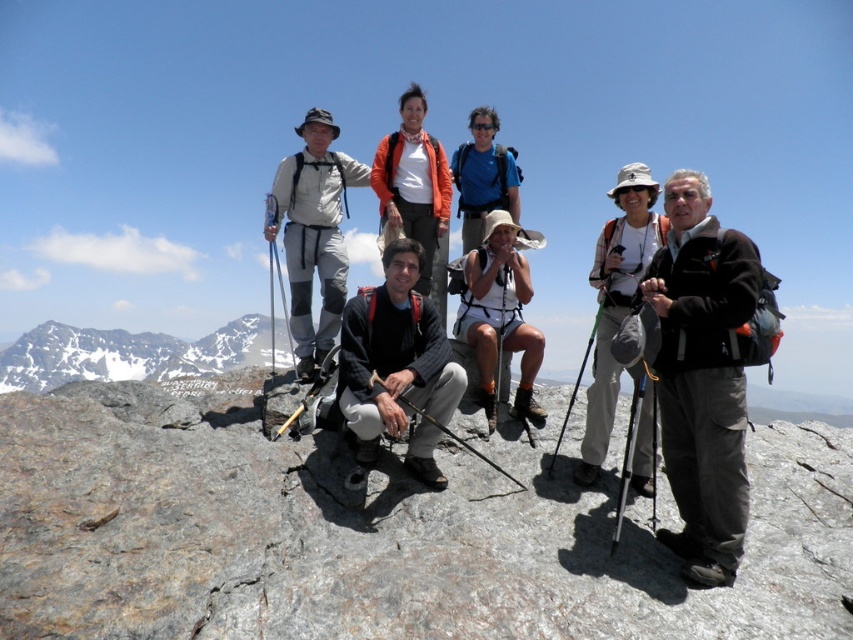
Is gray rock at center above black wool sweater at center?

Incorrect, gray rock at center is not positioned above black wool sweater at center.

Based on the photo, can you confirm if gray rock at center is thinner than black wool sweater at center?

No.

Locate an element on the screen. This screenshot has height=640, width=853. gray rock at center is located at coordinates (374, 538).

The height and width of the screenshot is (640, 853). I want to click on gray rock at center, so click(x=374, y=538).

Is gray rock at center to the left of blue fabric backpack at center from the viewer's perspective?

Indeed, gray rock at center is positioned on the left side of blue fabric backpack at center.

Which of these two, gray rock at center or blue fabric backpack at center, stands shorter?

Standing shorter between the two is gray rock at center.

Is point (171, 602) farther from viewer compared to point (479, 134)?

No, it is in front of (479, 134).

Where is `gray rock at center`? gray rock at center is located at coordinates (374, 538).

Does gray rock at center come in front of white fabric shorts at center?

Yes.

Identify the location of gray rock at center. The width and height of the screenshot is (853, 640). (374, 538).